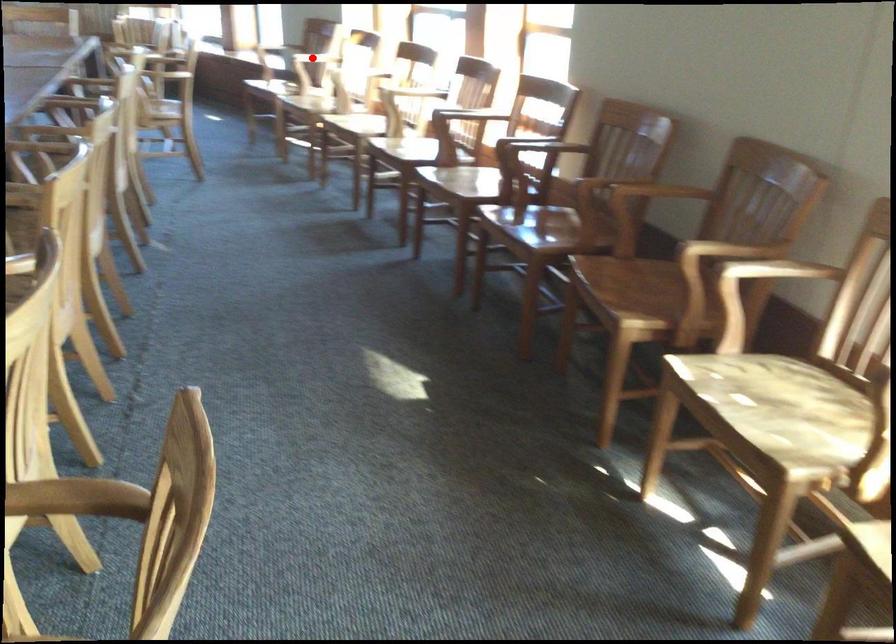
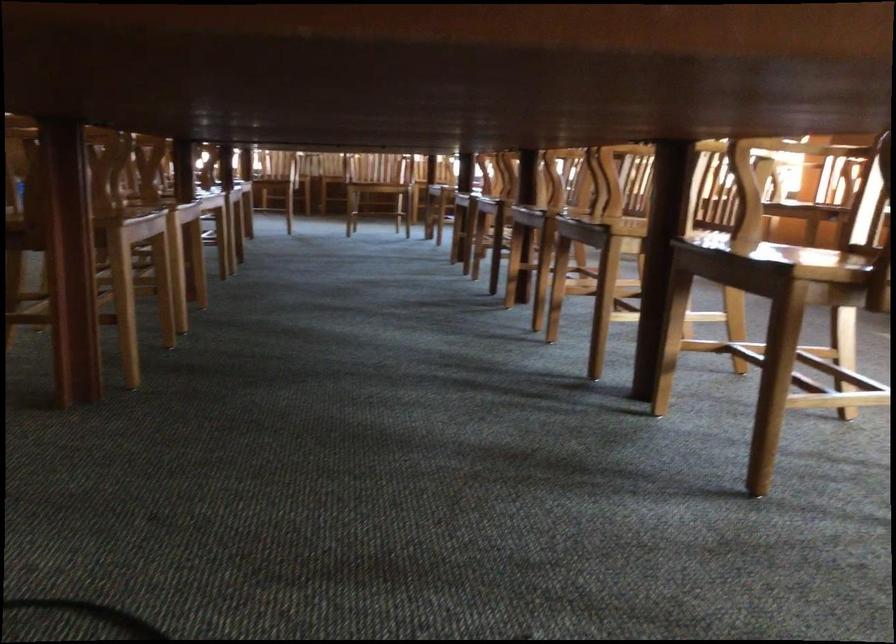
Question: I am providing you with two images of the same scene from different viewpoints. A red point is marked on the first image. At the location where the point appears in image 1, is it still visible in image 2?

Choices:
 (A) Yes
 (B) No

Answer: (B)